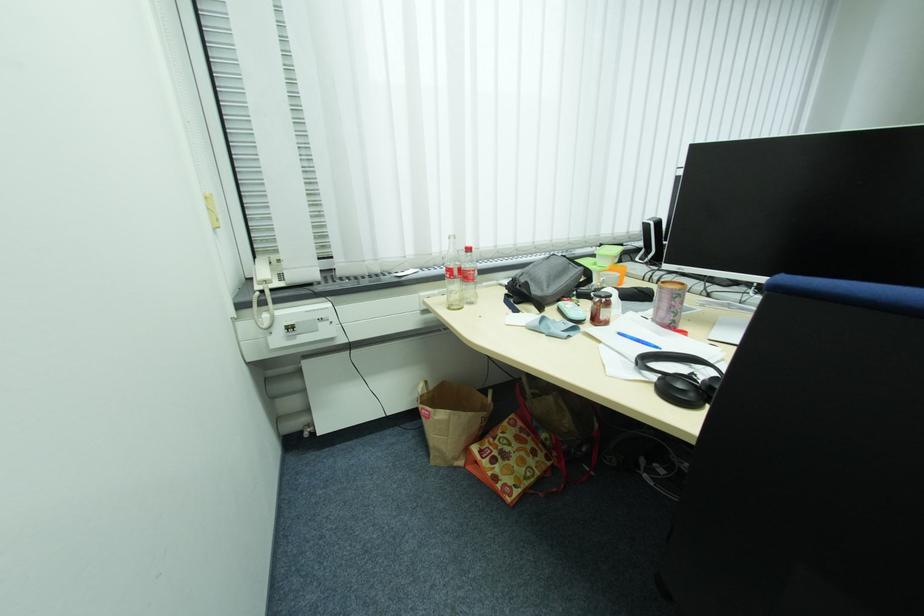
I want to click on grey zipper pouch, so click(546, 281).